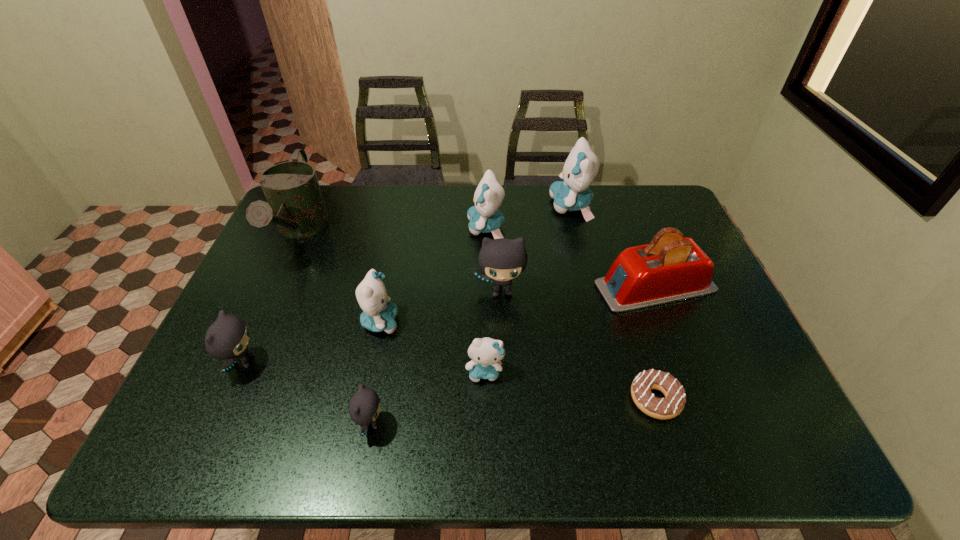
Find the location of a particular element. Image resolution: width=960 pixels, height=540 pixels. object identified as the eighth closest to the red toaster is located at coordinates (295, 204).

In order to click on object that is the third closest to the chocolate doughnut in this screenshot , I will do `click(502, 260)`.

Choose which kitten is the nearest neighbor to the nearest gray kitten. Please provide its 2D coordinates. Your answer should be formatted as a tuple, i.e. [(x, y)], where the tuple contains the x and y coordinates of a point satisfying the conditions above.

[(378, 315)]

Where is `kitten object that ranks as the seventh closest to the chocolate doughnut`? This screenshot has width=960, height=540. kitten object that ranks as the seventh closest to the chocolate doughnut is located at coordinates click(227, 338).

Locate which blue kitten is the second closest to the biggest gray kitten. Please provide its 2D coordinates. Your answer should be formatted as a tuple, i.e. [(x, y)], where the tuple contains the x and y coordinates of a point satisfying the conditions above.

[(378, 315)]

Locate an element on the screen. This screenshot has height=540, width=960. blue kitten that is the third closest to the rightmost blue kitten is located at coordinates (378, 315).

Where is `the second closest gray kitten to the second smallest gray kitten`? This screenshot has height=540, width=960. the second closest gray kitten to the second smallest gray kitten is located at coordinates (502, 260).

This screenshot has height=540, width=960. I want to click on gray kitten that is the second closest to the leftmost kitten, so click(x=502, y=260).

Find the location of a particular element. This screenshot has height=540, width=960. vacant space that satisfies the following two spatial constraints: 1. on the front-facing side of the shortest object; 2. on the right side of the biggest gray kitten is located at coordinates (507, 399).

Locate an element on the screen. This screenshot has width=960, height=540. vacant space that satisfies the following two spatial constraints: 1. on the face of the third smallest blue kitten; 2. on the back side of the shortest object is located at coordinates (489, 399).